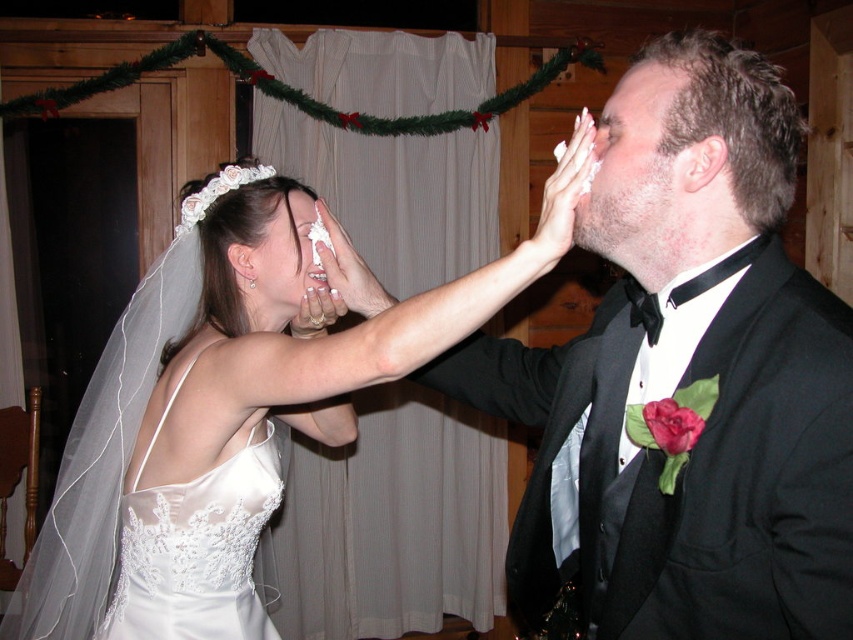
You are a photographer at the wedding and want to capture a shot of the white lace dress at upper left and the matte white cake at upper center. Since you can only focus on one subject at a time, which one should you choose to ensure the other remains in the background?

You should focus on the matte white cake at upper center because the white lace dress at upper left is to the left of it, placing the dress in the background if the cake is in focus.

You are a photographer at the wedding. You need to adjust the lighting so that the smooth skin face at right is well lit. Where should you place the light source relative to the point (636, 172)?

The smooth skin face at right is located at point (636, 172). To ensure proper lighting, position the light source directly in front of this point to illuminate the face evenly.

You are a photographer at a wedding. You need to take a photo of the matte white cake at upper center and the matte black forehead at upper right. The minimum distance your camera can focus clearly is 50 centimeters. Can you capture both objects in focus without moving the camera?

The matte white cake at upper center is 52.65 centimeters away from the matte black forehead at upper right. Since the distance between them is greater than the minimum focus distance of 50 centimeters, the camera can focus on both objects without needing to move.